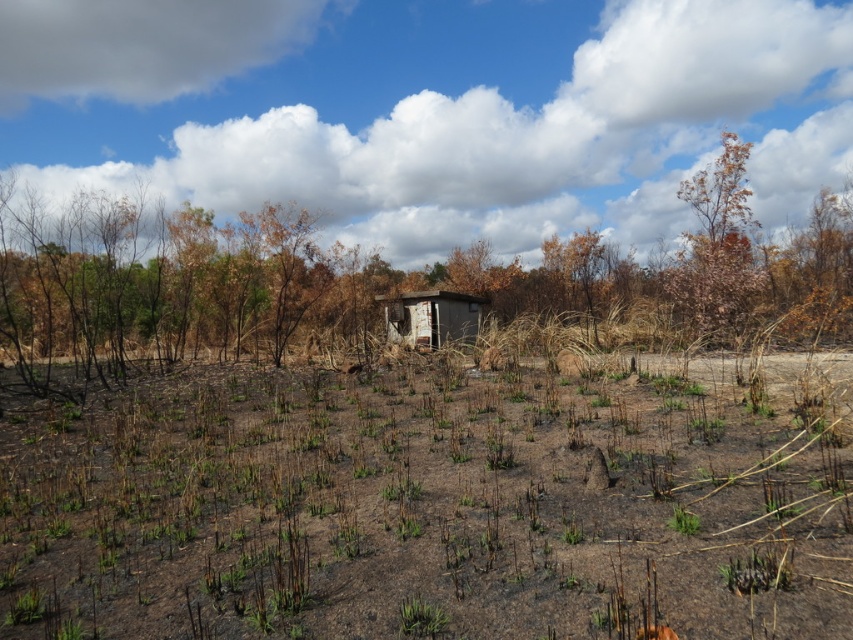
Which of these two, brown dry wood at center or weathered wood hut at center, stands shorter?

weathered wood hut at center is shorter.

How far apart are brown dry wood at center and weathered wood hut at center?

brown dry wood at center is 4.72 meters from weathered wood hut at center.

Between point (660, 273) and point (387, 337), which one is positioned in front?

Point (387, 337) is more forward.

Image resolution: width=853 pixels, height=640 pixels. In order to click on brown dry wood at center in this screenshot , I will do coord(383,276).

Is point (312, 132) more distant than point (737, 202)?

Yes, point (312, 132) is farther from viewer.

This screenshot has height=640, width=853. Describe the element at coordinates (434, 109) in the screenshot. I see `white fluffy cloud at upper center` at that location.

Who is more forward, [843,93] or [680,268]?

Point [680,268]

Where is `white fluffy cloud at upper center`? This screenshot has width=853, height=640. white fluffy cloud at upper center is located at coordinates (434, 109).

Does brown dry wood at center have a lesser width compared to brown dry wood at upper right?

Incorrect, brown dry wood at center's width is not less than brown dry wood at upper right's.

Is brown dry wood at center bigger than brown dry wood at upper right?

Correct, brown dry wood at center is larger in size than brown dry wood at upper right.

Is point (231, 284) positioned before point (724, 164)?

Yes, it is in front of point (724, 164).

Identify the location of brown dry wood at center. This screenshot has width=853, height=640. (383, 276).